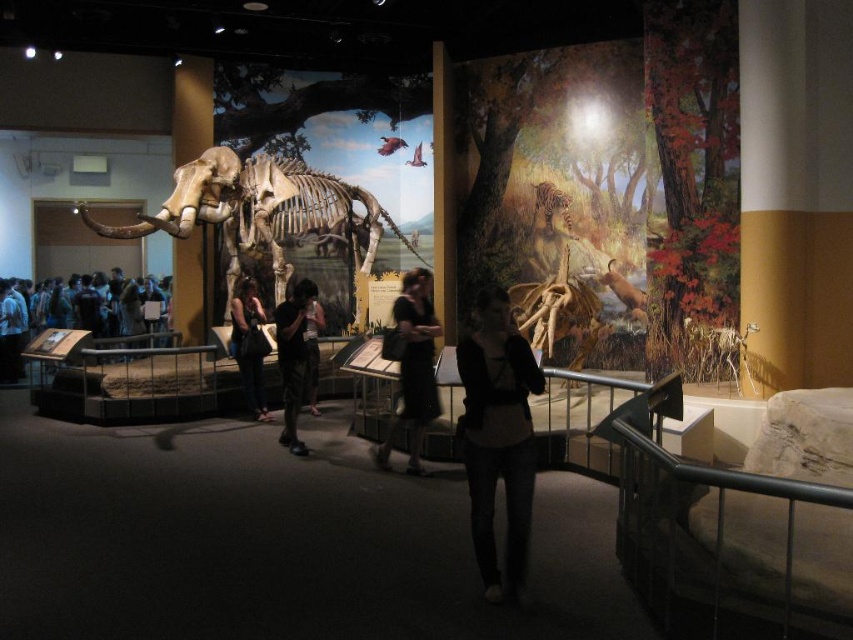
You are standing in the museum exhibit and want to take a photo of the mounted fossil skeleton on the left and the autumnal forest diorama on the right. If you position yourself at point (x=520, y=394), which object will appear closer to you in the photo?

The distance of point (x=520, y=394) from viewer is 11.81 feet, so the mounted fossil skeleton on the left will appear closer to you in the photo since it is positioned on the left side of the image and the distance from the point to the viewer is fixed.